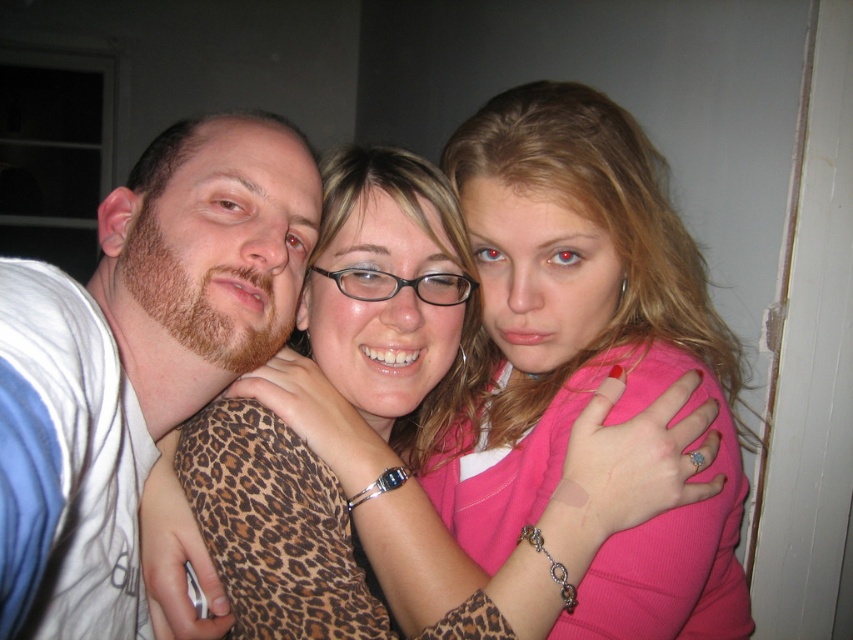
Question: Which point is closer to the camera?

Choices:
 (A) click(177, 493)
 (B) click(401, 467)

Answer: (B)

Question: In this image, where is leopard print top at center located relative to matte white t-shirt at left?

Choices:
 (A) below
 (B) above

Answer: (A)

Question: Is leopard print top at center above matte white t-shirt at left?

Choices:
 (A) yes
 (B) no

Answer: (B)

Question: Does leopard print top at center appear on the left side of matte white t-shirt at left?

Choices:
 (A) yes
 (B) no

Answer: (B)